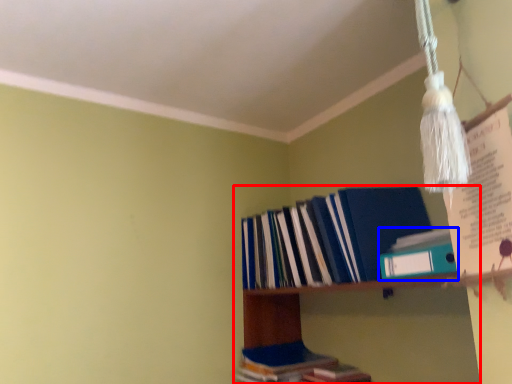
Question: Which of the following is the farthest to the observer, shelf (highlighted by a red box) or book (highlighted by a blue box)?

Choices:
 (A) shelf
 (B) book

Answer: (B)